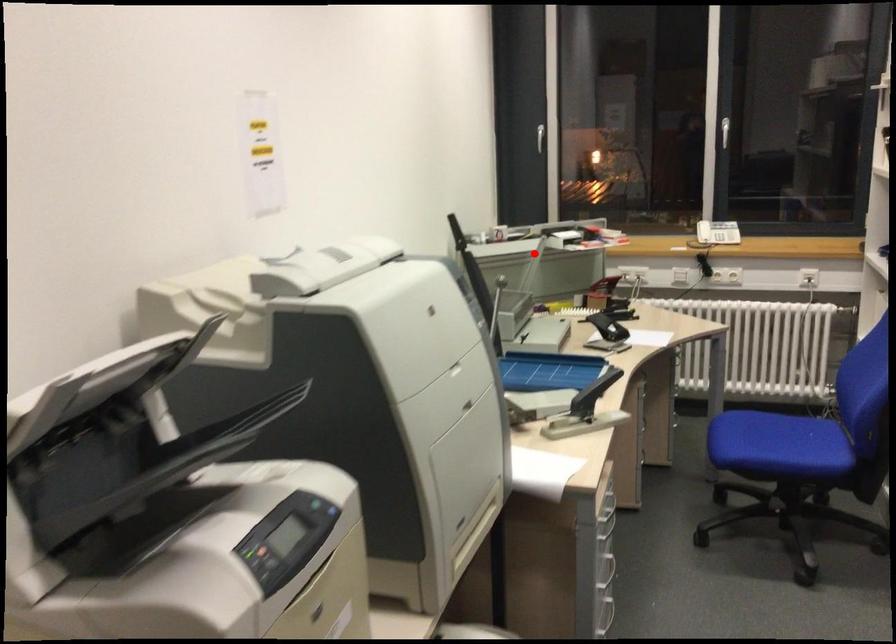
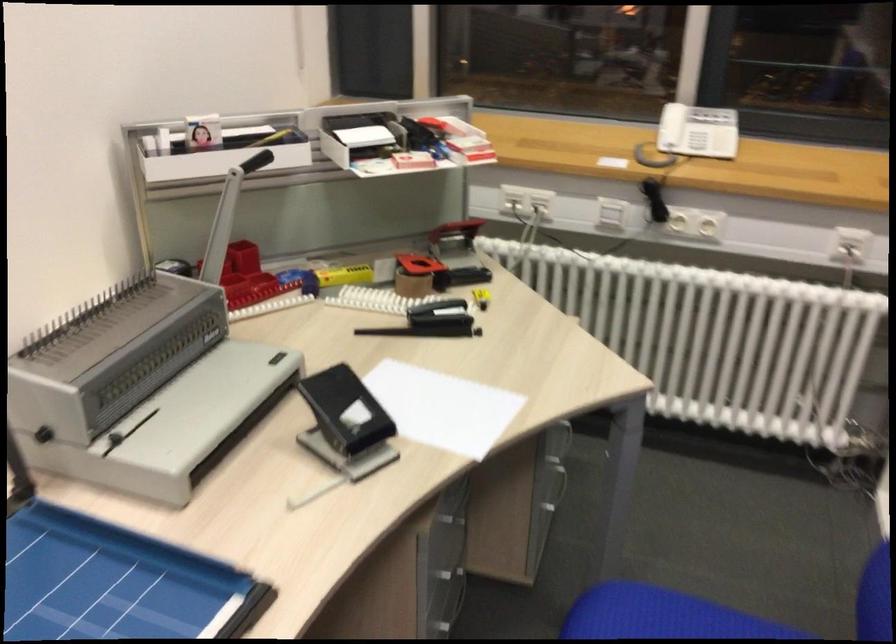
Question: A red point is marked in image1. In image2, is the corresponding 3D point closer to the camera or farther? Reply with the corresponding letter.

Choices:
 (A) The corresponding 3D point is closer.
 (B) The corresponding 3D point is farther.

Answer: (A)